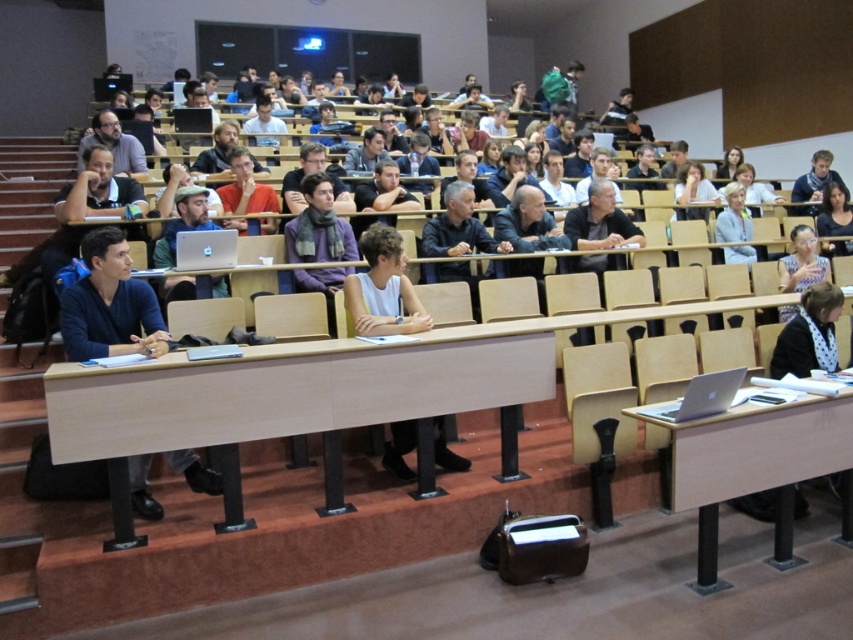
The height and width of the screenshot is (640, 853). Find the location of `light wood table at center`. light wood table at center is located at coordinates (296, 403).

Between point (529, 324) and point (793, 312), which one is positioned in front?

Point (529, 324)

Locate an element on the screen. The height and width of the screenshot is (640, 853). light wood table at center is located at coordinates (296, 403).

Between point (589, 248) and point (807, 189), which one is positioned in front?

Point (589, 248) is in front.

Between dark gray shirt at center and blue scarf at upper right, which one has less height?

With less height is dark gray shirt at center.

Between point (579, 246) and point (824, 180), which one is positioned behind?

The point (824, 180) is more distant.

You are a GUI agent. You are given a task and a screenshot of the screen. Output one action in this format:
    pyautogui.click(x=<x>, y=<y>)
    Task: Click on the dark gray shirt at center
    Image resolution: width=853 pixels, height=640 pixels.
    Given the screenshot: What is the action you would take?
    pyautogui.click(x=601, y=221)

Between silver metallic table at lower right and dark blue sweater at left, which one is positioned lower?

Positioned lower is silver metallic table at lower right.

Is silver metallic table at lower right positioned at the back of dark blue sweater at left?

No, silver metallic table at lower right is in front of dark blue sweater at left.

Which is in front, point (822, 461) or point (97, 288)?

Positioned in front is point (97, 288).

Image resolution: width=853 pixels, height=640 pixels. In order to click on silver metallic table at lower right in this screenshot , I will do `click(756, 465)`.